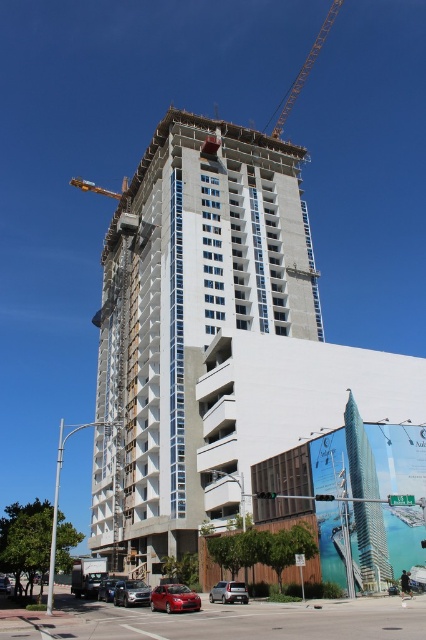
You are a delivery driver who needs to park your truck near the construction site. You see the metallic yellow crane at upper center and the metallic silver sedan at lower left. Which object is positioned to the right side of the other?

The metallic yellow crane at upper center is to the right of the metallic silver sedan at lower left according to the description.

Based on the photo, you are a pedestrian standing on the sidewalk near the metallic silver sedan at lower left. You notice the metallic yellow crane at upper center above you. What is the relationship between the crane and the sedan?

Answer: The metallic yellow crane at upper center is positioned over the metallic silver sedan at lower left, meaning the crane is directly above the sedan in the scene.

You are a pedestrian standing on the sidewalk near the shiny black sedan at lower left. You want to take a photo of the metallic yellow crane at upper center without any obstructions. Is there any object between you and the crane that might block your view?

The shiny black sedan at lower left is behind the metallic yellow crane at upper center, so there are no objects between you and the crane that would block your view.